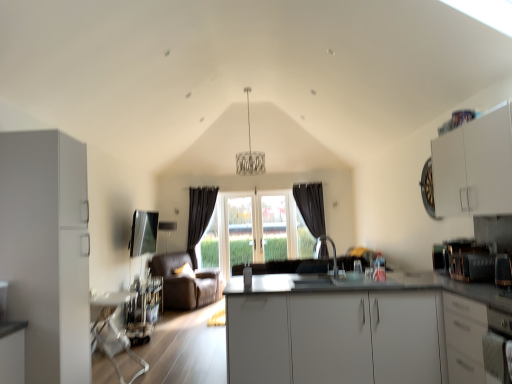
Describe the element at coordinates (464, 339) in the screenshot. I see `white glossy cabinet at right, the 2th cabinetry when ordered from right to left` at that location.

I want to click on white glossy cabinet at right, which is counted as the 2th cabinetry, starting from the left, so click(x=464, y=339).

What are the coordinates of `white glossy table at lower left` in the screenshot? It's located at point(113,328).

How much space does dark fabric curtain at center, the first curtain when ordered from left to right, occupy horizontally?

8.19 inches.

Locate an element on the screen. satin silver oven at lower right is located at coordinates (498, 348).

Locate an element on the screen. The width and height of the screenshot is (512, 384). transparent glass window at center is located at coordinates (282, 220).

In terms of width, does metallic silver toaster at right look wider or thinner when compared to white glossy countertop at center?

metallic silver toaster at right is thinner than white glossy countertop at center.

What are the coordinates of `appliance above the white glossy countertop at center (from the image's perspective)` in the screenshot? It's located at (470, 261).

Does metallic silver toaster at right appear on the right side of white glossy countertop at center?

Indeed, metallic silver toaster at right is positioned on the right side of white glossy countertop at center.

Would you say metallic silver toaster at right contains white glossy countertop at center?

No, white glossy countertop at center is not surrounded by metallic silver toaster at right.

Which is in front, white glossy table at lower left or white matte cabinet at left, the 1th cabinetry from the left?

white matte cabinet at left, the 1th cabinetry from the left, is in front.

Is white glossy table at lower left inside or outside of white matte cabinet at left, acting as the 3th cabinetry starting from the right?

white glossy table at lower left is spatially situated outside white matte cabinet at left, acting as the 3th cabinetry starting from the right.

From the image's perspective, is white glossy countertop at center above or below white glossy cabinet at right, the 2th cabinetry when ordered from right to left?

white glossy countertop at center is below white glossy cabinet at right, the 2th cabinetry when ordered from right to left.

What's the angular difference between white glossy countertop at center and white glossy cabinet at right, which is counted as the 2th cabinetry, starting from the left,'s facing directions?

The angle between the facing direction of white glossy countertop at center and the facing direction of white glossy cabinet at right, which is counted as the 2th cabinetry, starting from the left, is 90 degrees.

Can you confirm if white glossy countertop at center is taller than white glossy cabinet at right, which is counted as the 2th cabinetry, starting from the left?

Correct, white glossy countertop at center is much taller as white glossy cabinet at right, which is counted as the 2th cabinetry, starting from the left.

Is white glossy countertop at center not close to white glossy cabinet at right, which is counted as the 2th cabinetry, starting from the left?

white glossy countertop at center is actually quite close to white glossy cabinet at right, which is counted as the 2th cabinetry, starting from the left.

Is white matte cabinet at upper right, the first cabinetry from the right, situated inside transparent glass window at center or outside?

white matte cabinet at upper right, the first cabinetry from the right, lies outside transparent glass window at center.

Looking at this image, how distant is white matte cabinet at upper right, the first cabinetry from the right, from transparent glass window at center?

A distance of 4.19 meters exists between white matte cabinet at upper right, the first cabinetry from the right, and transparent glass window at center.

Is the position of white matte cabinet at upper right, the 3th cabinetry positioned from the left, less distant than that of transparent glass window at center?

Yes.

From the picture: Which is more to the left, white matte cabinet at upper right, the first cabinetry from the right, or transparent glass window at center?

Positioned to the left is transparent glass window at center.

Is dark fabric curtain at center, the first curtain when ordered from left to right, wider or thinner than white glossy cabinet at right, the 2th cabinetry when ordered from right to left?

Considering their sizes, dark fabric curtain at center, the first curtain when ordered from left to right, looks slimmer than white glossy cabinet at right, the 2th cabinetry when ordered from right to left.

What's the angular difference between dark fabric curtain at center, the first curtain when ordered from left to right, and white glossy cabinet at right, the 2th cabinetry when ordered from right to left,'s facing directions?

89.2 degrees.

Considering the relative sizes of dark fabric curtain at center, marked as the 2th curtain in a right-to-left arrangement, and white glossy cabinet at right, the 2th cabinetry when ordered from right to left, in the image provided, is dark fabric curtain at center, marked as the 2th curtain in a right-to-left arrangement, bigger than white glossy cabinet at right, the 2th cabinetry when ordered from right to left,?

Incorrect, dark fabric curtain at center, marked as the 2th curtain in a right-to-left arrangement, is not larger than white glossy cabinet at right, the 2th cabinetry when ordered from right to left.

Is dark fabric curtain at center, marked as the 2th curtain in a right-to-left arrangement, touching white glossy cabinet at right, the 2th cabinetry when ordered from right to left?

dark fabric curtain at center, marked as the 2th curtain in a right-to-left arrangement, and white glossy cabinet at right, the 2th cabinetry when ordered from right to left, are not in contact.

Is white glossy cabinet at right, the 2th cabinetry when ordered from right to left, at the left side of brown leather armchair at center?

No, white glossy cabinet at right, the 2th cabinetry when ordered from right to left, is not to the left of brown leather armchair at center.

From a real-world perspective, is white glossy cabinet at right, the 2th cabinetry when ordered from right to left, positioned under brown leather armchair at center based on gravity?

Incorrect, from a real-world perspective, white glossy cabinet at right, the 2th cabinetry when ordered from right to left, is higher than brown leather armchair at center.

Considering the positions of point (467, 379) and point (192, 306), is point (467, 379) closer or farther from the camera than point (192, 306)?

Point (467, 379) is positioned closer to the camera compared to point (192, 306).

Is white glossy cabinet at right, which is counted as the 2th cabinetry, starting from the left, directly adjacent to brown leather armchair at center?

There is a gap between white glossy cabinet at right, which is counted as the 2th cabinetry, starting from the left, and brown leather armchair at center.

Is white matte cabinet at left, the 1th cabinetry from the left, at the left side of satin nickel faucet at center?

Indeed, white matte cabinet at left, the 1th cabinetry from the left, is positioned on the left side of satin nickel faucet at center.

Image resolution: width=512 pixels, height=384 pixels. I want to click on sink that appears below the white matte cabinet at left, acting as the 3th cabinetry starting from the right (from the image's perspective), so click(333, 254).

Is white matte cabinet at left, the 1th cabinetry from the left, in contact with satin nickel faucet at center?

No, white matte cabinet at left, the 1th cabinetry from the left, is not making contact with satin nickel faucet at center.

Looking at their sizes, would you say white matte cabinet at left, acting as the 3th cabinetry starting from the right, is wider or thinner than satin nickel faucet at center?

Considering their sizes, white matte cabinet at left, acting as the 3th cabinetry starting from the right, looks broader than satin nickel faucet at center.

At what (x,y) coordinates should I click in order to perform the action: click on appliance lying on the right of white glossy countertop at center. Please return your answer as a coordinate pair (x, y). Looking at the image, I should click on (470, 261).

Image resolution: width=512 pixels, height=384 pixels. In order to click on table below the white matte cabinet at left, acting as the 3th cabinetry starting from the right (from the image's perspective) in this screenshot , I will do `click(113, 328)`.

From the image, which object appears to be nearer to transparent glass window at center, white matte cabinet at upper right, the 3th cabinetry positioned from the left, or white glossy countertop at center?

white glossy countertop at center is positioned closer to the anchor transparent glass window at center.

Estimate the real-world distances between objects in this image. Which object is closer to satin nickel faucet at center, white glossy cabinet at right, which is counted as the 2th cabinetry, starting from the left, or transparent glass window at center?

transparent glass window at center is positioned closer to the anchor satin nickel faucet at center.

Considering their positions, is transparent glass window at center positioned further to metallic silver toaster at right than dark fabric curtain at center, the first curtain when ordered from left to right?

dark fabric curtain at center, the first curtain when ordered from left to right, is positioned further to the anchor metallic silver toaster at right.

Based on their spatial positions, is white matte cabinet at left, the 1th cabinetry from the left, or transparent glass window at center further from dark grey fabric curtain at center, placed as the first curtain when sorted from right to left?

The object further to dark grey fabric curtain at center, placed as the first curtain when sorted from right to left, is white matte cabinet at left, the 1th cabinetry from the left.

Looking at the image, which one is located closer to dark grey fabric curtain at center, the second curtain viewed from the left, white matte cabinet at left, the 1th cabinetry from the left, or satin nickel faucet at center?

satin nickel faucet at center is closer to dark grey fabric curtain at center, the second curtain viewed from the left.

Based on their spatial positions, is satin nickel faucet at center or white matte cabinet at upper right, the 3th cabinetry positioned from the left, further from satin silver oven at lower right?

satin nickel faucet at center.

Estimate the real-world distances between objects in this image. Which object is closer to white glossy cabinet at right, the 2th cabinetry when ordered from right to left, satin nickel faucet at center or dark grey fabric curtain at center, the second curtain viewed from the left?

Based on the image, satin nickel faucet at center appears to be nearer to white glossy cabinet at right, the 2th cabinetry when ordered from right to left.

Based on their spatial positions, is satin silver oven at lower right or white glossy cabinet at right, the 2th cabinetry when ordered from right to left, further from white glossy countertop at center?

satin silver oven at lower right lies further to white glossy countertop at center than the other object.

I want to click on window between brown leather armchair at center and dark grey fabric curtain at center, the second curtain viewed from the left, in the horizontal direction, so click(282, 220).

Find the location of a particular element. table located between white matte cabinet at left, the 1th cabinetry from the left, and dark fabric curtain at center, the first curtain when ordered from left to right, in the depth direction is located at coordinates (113, 328).

Where is `armchair positioned between white glossy cabinet at right, the 2th cabinetry when ordered from right to left, and dark fabric curtain at center, the first curtain when ordered from left to right, from near to far`? This screenshot has width=512, height=384. armchair positioned between white glossy cabinet at right, the 2th cabinetry when ordered from right to left, and dark fabric curtain at center, the first curtain when ordered from left to right, from near to far is located at coordinates (184, 282).

The height and width of the screenshot is (384, 512). What are the coordinates of `sink between metallic silver toaster at right and dark grey fabric curtain at center, placed as the first curtain when sorted from right to left, in the front-back direction` in the screenshot? It's located at (333, 254).